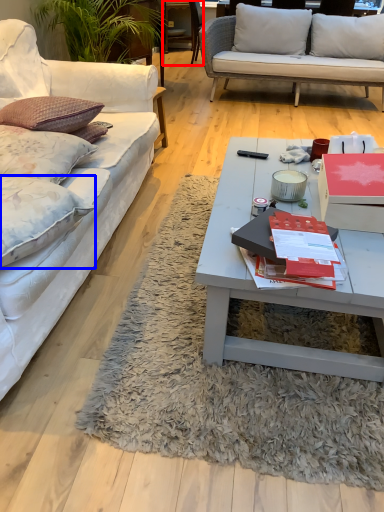
Question: Which object appears farthest to the camera in this image, chair (highlighted by a red box) or pillow (highlighted by a blue box)?

Choices:
 (A) chair
 (B) pillow

Answer: (A)